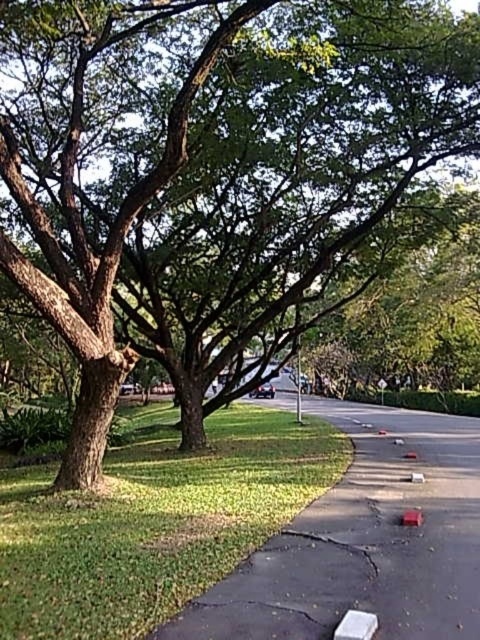
You are planning to set up a picnic blanket in the park. The picnic blanket is 2 meters wide. You have two options for placement near the green grass at lower left and smooth asphalt sidewalk at lower center. Which location has enough space for the blanket?

The smooth asphalt sidewalk at lower center has enough space for the picnic blanket since it is larger than the green grass at lower left, which is smaller and may not accommodate the 2 meter width.

You are standing at the edge of the park and notice the green grass at lower left and the smooth asphalt sidewalk at lower center. Which of these two features is positioned lower in the image?

The green grass at lower left is positioned lower than the smooth asphalt sidewalk at lower center in the image.

Consider the image. You are planning to set up a small picnic area in the park. You need to choose between the green grass at lower left and the smooth asphalt sidewalk at lower center. Considering their widths, which location would be more suitable for a picnic and why?

Result: The smooth asphalt sidewalk at lower center is more suitable for a picnic because it has a greater width than the green grass at lower left, providing more space for setting up.